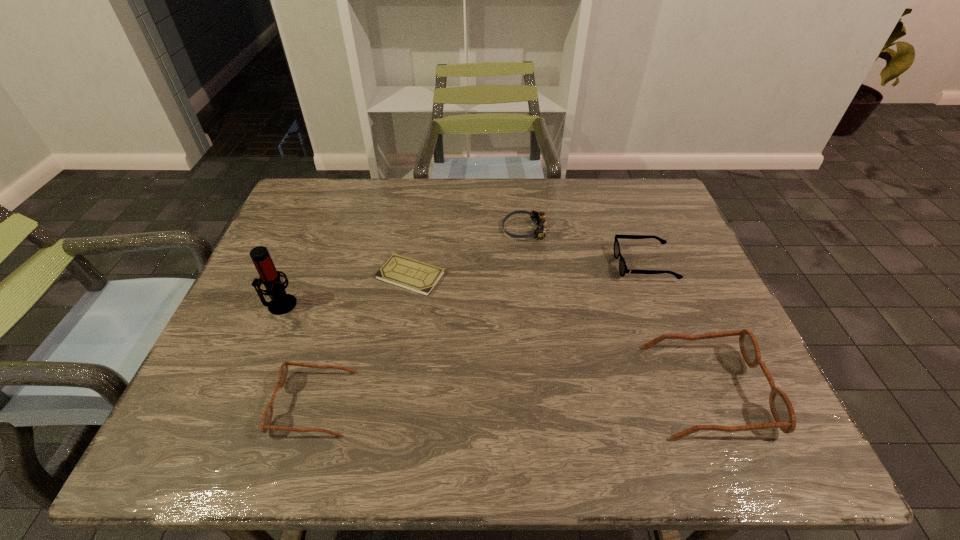
This screenshot has width=960, height=540. I want to click on object that is positioned at the near right corner, so click(782, 410).

At what (x,y) coordinates should I click in order to perform the action: click on free space at the far edge of the desktop. Please return your answer as a coordinate pair (x, y). The height and width of the screenshot is (540, 960). Looking at the image, I should click on (392, 201).

Find the location of a particular element. free space at the near edge of the desktop is located at coordinates (600, 394).

Where is `vacant space at the left edge of the desktop`? vacant space at the left edge of the desktop is located at coordinates (x=292, y=252).

This screenshot has height=540, width=960. I want to click on free space at the right edge of the desktop, so click(x=710, y=350).

Identify the location of vacant area at the far right corner. The width and height of the screenshot is (960, 540). (626, 191).

Locate an element on the screen. free space between the tallest spectacles and the goggles is located at coordinates (616, 310).

This screenshot has width=960, height=540. I want to click on blank region between the leftmost object and the checkbook, so click(x=346, y=290).

At what (x,y) coordinates should I click in order to perform the action: click on free spot between the tallest spectacles and the microphone. Please return your answer as a coordinate pair (x, y). Image resolution: width=960 pixels, height=540 pixels. Looking at the image, I should click on (493, 347).

In order to click on free space between the leftmost spectacles and the fifth shortest object in this screenshot , I will do `click(510, 396)`.